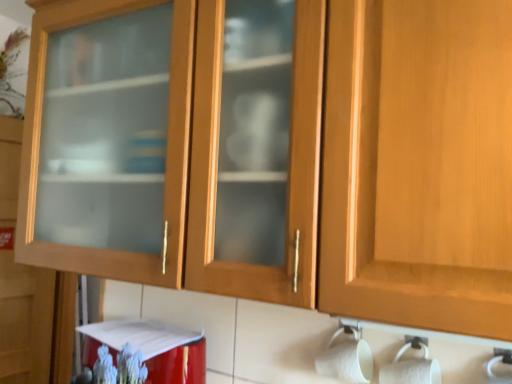
What is the approximate width of matte glass cabinet at left?

It is 5.34 inches.

The width and height of the screenshot is (512, 384). What are the coordinates of `white matte toilet paper at lower right` in the screenshot? It's located at (347, 361).

From a real-world perspective, relative to matte glass cabinet at left, is white matte toilet paper at lower right vertically above or below?

Clearly, from a real-world perspective, white matte toilet paper at lower right is below matte glass cabinet at left.

Can you confirm if white matte toilet paper at lower right is bigger than matte glass cabinet at left?

No, white matte toilet paper at lower right is not bigger than matte glass cabinet at left.

Locate an element on the screen. The image size is (512, 384). toilet paper lying below the matte glass cabinet at left (from the image's perspective) is located at coordinates coord(347,361).

Can matte glass cabinet at left be found inside white matte toilet paper at lower right?

Actually, matte glass cabinet at left is outside white matte toilet paper at lower right.

Is matte glass cabinet at left at the back of red glossy appliance at lower left?

No, red glossy appliance at lower left is not facing away from matte glass cabinet at left.

From a real-world perspective, between red glossy appliance at lower left and matte glass cabinet at left, who is vertically higher?

matte glass cabinet at left, from a real-world perspective.

Considering the positions of points (122, 334) and (0, 156), is point (122, 334) farther from camera compared to point (0, 156)?

No, (122, 334) is closer to viewer.

Choose the correct answer: Is red glossy appliance at lower left inside matte glass cabinet at left or outside it?

red glossy appliance at lower left is located beyond the bounds of matte glass cabinet at left.

Is there a large distance between matte glass cabinet at left and white matte toilet paper at lower right?

That's right, there is a large distance between matte glass cabinet at left and white matte toilet paper at lower right.

Is matte glass cabinet at left at the right side of white matte toilet paper at lower right?

Incorrect, matte glass cabinet at left is not on the right side of white matte toilet paper at lower right.

Between matte glass cabinet at left and white matte toilet paper at lower right, which one has smaller width?

white matte toilet paper at lower right.

Locate an element on the screen. toilet paper on the right of matte glass cabinet at left is located at coordinates (347, 361).

Is white matte toilet paper at lower right shorter than red glossy appliance at lower left?

Yes.

Relative to red glossy appliance at lower left, is white matte toilet paper at lower right in front or behind?

white matte toilet paper at lower right is in front of red glossy appliance at lower left.

Are white matte toilet paper at lower right and red glossy appliance at lower left located far from each other?

No, there isn't a large distance between white matte toilet paper at lower right and red glossy appliance at lower left.

Does red glossy appliance at lower left appear on the left side of white matte toilet paper at lower right?

Correct, you'll find red glossy appliance at lower left to the left of white matte toilet paper at lower right.

Based on the photo, does red glossy appliance at lower left have a lesser width compared to white matte toilet paper at lower right?

No, red glossy appliance at lower left is not thinner than white matte toilet paper at lower right.

From a real-world perspective, which is physically below, red glossy appliance at lower left or white matte toilet paper at lower right?

red glossy appliance at lower left, from a real-world perspective.

Identify the location of toilet paper in front of the red glossy appliance at lower left. This screenshot has width=512, height=384. (347, 361).

In terms of width, does matte glass cabinet at left look wider or thinner when compared to red glossy appliance at lower left?

In the image, matte glass cabinet at left appears to be more narrow than red glossy appliance at lower left.

Is matte glass cabinet at left positioned far away from red glossy appliance at lower left?

That's right, there is a large distance between matte glass cabinet at left and red glossy appliance at lower left.

Is red glossy appliance at lower left surrounded by matte glass cabinet at left?

No.

Based on the photo, does matte glass cabinet at left have a lesser height compared to red glossy appliance at lower left?

No.

Where is `toilet paper below the matte glass cabinet at left (from the image's perspective)`? The height and width of the screenshot is (384, 512). toilet paper below the matte glass cabinet at left (from the image's perspective) is located at coordinates (347, 361).

In order to click on appliance below the matte glass cabinet at left (from a real-world perspective) in this screenshot , I will do `click(151, 348)`.

Which object lies nearer to the anchor point white matte toilet paper at lower right, red glossy appliance at lower left or matte glass cabinet at left?

Among the two, red glossy appliance at lower left is located nearer to white matte toilet paper at lower right.

Which object lies further to the anchor point red glossy appliance at lower left, white matte toilet paper at lower right or matte glass cabinet at left?

matte glass cabinet at left lies further to red glossy appliance at lower left than the other object.

Looking at the image, which one is located closer to white matte toilet paper at lower right, matte glass cabinet at left or red glossy appliance at lower left?

red glossy appliance at lower left is positioned closer to the anchor white matte toilet paper at lower right.

When comparing their distances from matte glass cabinet at left, does white matte toilet paper at lower right or red glossy appliance at lower left seem closer?

red glossy appliance at lower left is positioned closer to the anchor matte glass cabinet at left.

Which object lies further to the anchor point red glossy appliance at lower left, matte glass cabinet at left or white matte toilet paper at lower right?

matte glass cabinet at left lies further to red glossy appliance at lower left than the other object.

Considering their positions, is red glossy appliance at lower left positioned closer to matte glass cabinet at left than white matte toilet paper at lower right?

red glossy appliance at lower left is closer to matte glass cabinet at left.

Locate an element on the screen. The height and width of the screenshot is (384, 512). appliance between matte glass cabinet at left and white matte toilet paper at lower right is located at coordinates (151, 348).